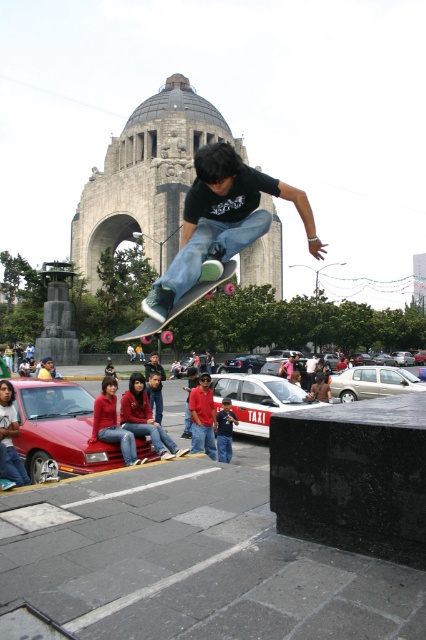
You are a photographer trying to capture the skateboarder in the plaza. You notice the red cotton shirt at center and the blue denim jeans at center. Which clothing item is closer to the camera?

The red cotton shirt at center is in front of the blue denim jeans at center, so it is closer to the camera.

You are standing in the plaza and want to place a small bench between the two points, point [279,192] and point [230,266]. Based on their positions, which point should the bench be closer to?

The bench should be closer to point [230,266] because point [279,192] is behind point [230,266], meaning the latter is closer to the observer.

You are a photographer trying to capture the skateboarder midair. The matte black skateboard at center is at point 0.348, 0.521. If you want to place the skateboarder in the center of your photo, should you adjust your camera to the left or right?

The matte black skateboard at center is already at the center of the image, so no adjustment is needed.